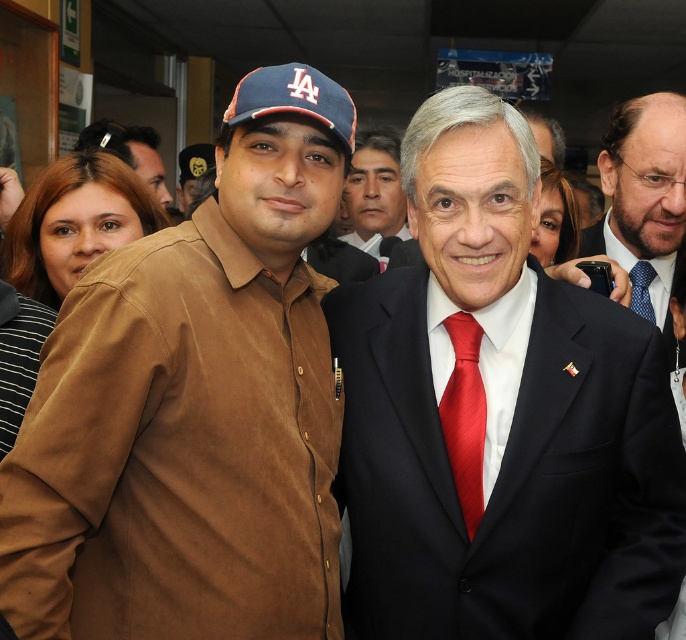
Question: Which object is the closest to the blue fabric baseball cap at left?

Choices:
 (A) brown suede shirt at left
 (B) blue dotted tie at center
 (C) brown cotton shirt at center

Answer: (A)

Question: Is blue fabric baseball cap at left further to the viewer compared to brown cotton shirt at center?

Choices:
 (A) yes
 (B) no

Answer: (B)

Question: Can you confirm if matte black suit at center is wider than blue dotted tie at center?

Choices:
 (A) no
 (B) yes

Answer: (B)

Question: Is brown suede shirt at left bigger than blue dotted tie at center?

Choices:
 (A) no
 (B) yes

Answer: (B)

Question: Which object is the farthest from the matte black suit at center?

Choices:
 (A) blue dotted tie at right
 (B) blue dotted tie at center

Answer: (A)

Question: Which object appears farthest from the camera in this image?

Choices:
 (A) blue dotted tie at center
 (B) brown suede shirt at left
 (C) blue fabric baseball cap at left

Answer: (A)